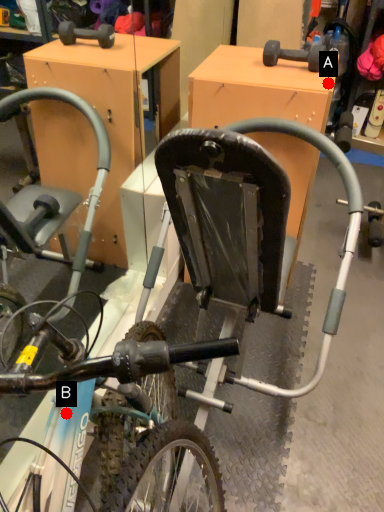
Question: Two points are circled on the image, labeled by A and B beside each circle. Which of the following is the closest to the observer?

Choices:
 (A) A is closer
 (B) B is closer

Answer: (B)